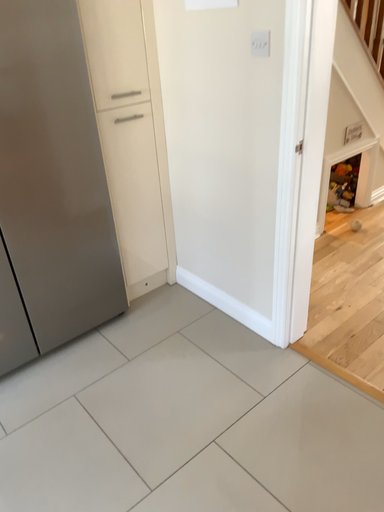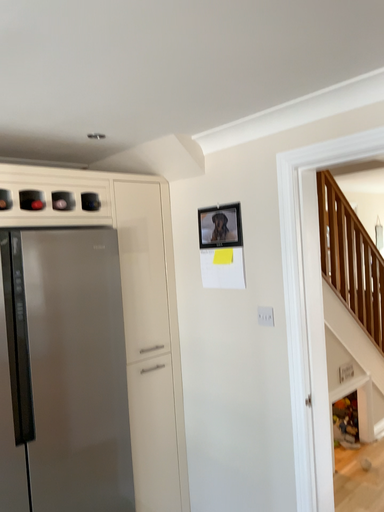
Question: Which way did the camera rotate in the video?

Choices:
 (A) rotated upward
 (B) rotated downward

Answer: (A)